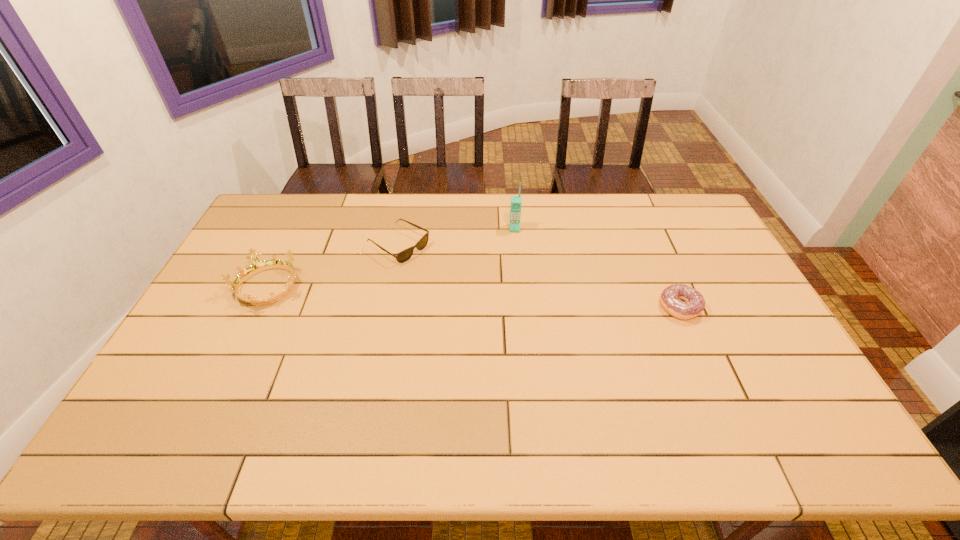
This screenshot has width=960, height=540. I want to click on free space at the near left corner of the desktop, so click(161, 380).

This screenshot has width=960, height=540. I want to click on free space at the far right corner of the desktop, so [692, 216].

Find the location of `vacant space that is in between the cellular telephone and the third shortest object`. vacant space that is in between the cellular telephone and the third shortest object is located at coordinates (391, 258).

Locate an element on the screen. This screenshot has height=540, width=960. free area in between the sunglasses and the doughnut is located at coordinates (540, 276).

Where is `free space between the tallest object and the doughnut`? free space between the tallest object and the doughnut is located at coordinates (597, 268).

You are a GUI agent. You are given a task and a screenshot of the screen. Output one action in this format:
    pyautogui.click(x=<x>, y=<y>)
    Task: Click on the vacant space that's between the leftmost object and the third object from right to left
    Image resolution: width=960 pixels, height=540 pixels.
    Given the screenshot: What is the action you would take?
    pyautogui.click(x=333, y=267)

Locate an element on the screen. The height and width of the screenshot is (540, 960). vacant space that is in between the third object from right to left and the crown is located at coordinates (333, 267).

Locate an element on the screen. vacant space in between the rightmost object and the tallest object is located at coordinates (597, 268).

This screenshot has height=540, width=960. I want to click on vacant area that lies between the third object from right to left and the crown, so click(x=333, y=267).

This screenshot has width=960, height=540. I want to click on vacant area that lies between the second object from left to right and the third shortest object, so click(333, 267).